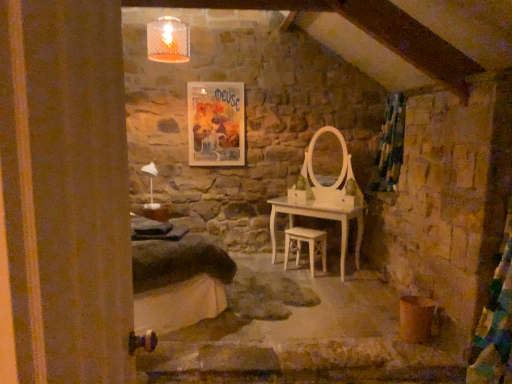
Question: Is matte paper poster at upper center shorter than green fabric curtain at right?

Choices:
 (A) yes
 (B) no

Answer: (A)

Question: Could green fabric curtain at right be considered to be inside matte paper poster at upper center?

Choices:
 (A) yes
 (B) no

Answer: (B)

Question: Is the position of matte paper poster at upper center more distant than that of green fabric curtain at right?

Choices:
 (A) no
 (B) yes

Answer: (B)

Question: Considering the relative positions of matte paper poster at upper center and green fabric curtain at right in the image provided, is matte paper poster at upper center to the right of green fabric curtain at right from the viewer's perspective?

Choices:
 (A) yes
 (B) no

Answer: (B)

Question: From the image's perspective, is matte paper poster at upper center over green fabric curtain at right?

Choices:
 (A) yes
 (B) no

Answer: (A)

Question: Is green fabric curtain at right wider or thinner than white glossy table lamp at left?

Choices:
 (A) thin
 (B) wide

Answer: (A)

Question: From a real-world perspective, is green fabric curtain at right above or below white glossy table lamp at left?

Choices:
 (A) above
 (B) below

Answer: (A)

Question: Is green fabric curtain at right in front of or behind white glossy table lamp at left in the image?

Choices:
 (A) front
 (B) behind

Answer: (B)

Question: In terms of height, does green fabric curtain at right look taller or shorter compared to white glossy table lamp at left?

Choices:
 (A) tall
 (B) short

Answer: (A)

Question: Relative to white glossy table lamp at left, is white wooden stool at center in front or behind?

Choices:
 (A) behind
 (B) front

Answer: (A)

Question: In terms of width, does white wooden stool at center look wider or thinner when compared to white glossy table lamp at left?

Choices:
 (A) thin
 (B) wide

Answer: (A)

Question: From a real-world perspective, is white wooden stool at center above or below white glossy table lamp at left?

Choices:
 (A) above
 (B) below

Answer: (B)

Question: Would you say white wooden stool at center is to the left or to the right of white glossy table lamp at left in the picture?

Choices:
 (A) left
 (B) right

Answer: (B)

Question: Considering the relative positions of white glossy table lamp at left and matte paper poster at upper center in the image provided, is white glossy table lamp at left to the left or to the right of matte paper poster at upper center?

Choices:
 (A) right
 (B) left

Answer: (B)

Question: Considering the positions of point (156, 168) and point (197, 84), is point (156, 168) closer or farther from the camera than point (197, 84)?

Choices:
 (A) farther
 (B) closer

Answer: (A)